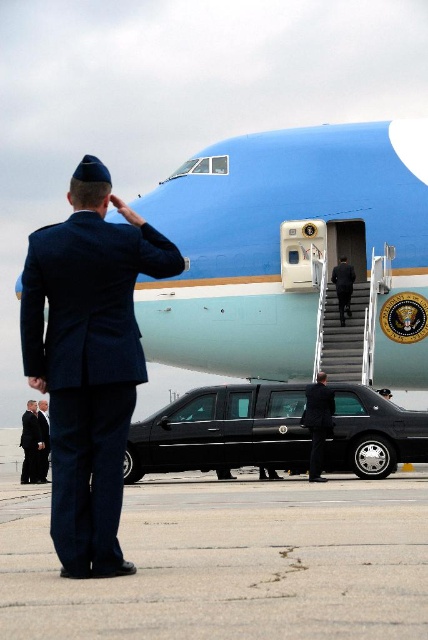
Question: Among these objects, which one is nearest to the camera?

Choices:
 (A) gray concrete tarmac at lower center
 (B) navy blue uniform at center
 (C) black glossy limousine at center

Answer: (A)

Question: Estimate the real-world distances between objects in this image. Which object is farther from the black suit at center?

Choices:
 (A) navy blue uniform at center
 (B) gray concrete tarmac at lower center
 (C) dark blue uniform at left

Answer: (A)

Question: Can you confirm if gray concrete tarmac at lower center is positioned to the right of navy blue uniform at center?

Choices:
 (A) yes
 (B) no

Answer: (A)

Question: Among these points, which one is nearest to the camera?

Choices:
 (A) (324, 388)
 (B) (85, 307)
 (C) (47, 419)
 (D) (362, 404)

Answer: (B)

Question: Does blue metallic airplane at center appear under black suit at center?

Choices:
 (A) yes
 (B) no

Answer: (B)

Question: Is blue metallic airplane at center smaller than black suit at center?

Choices:
 (A) yes
 (B) no

Answer: (B)